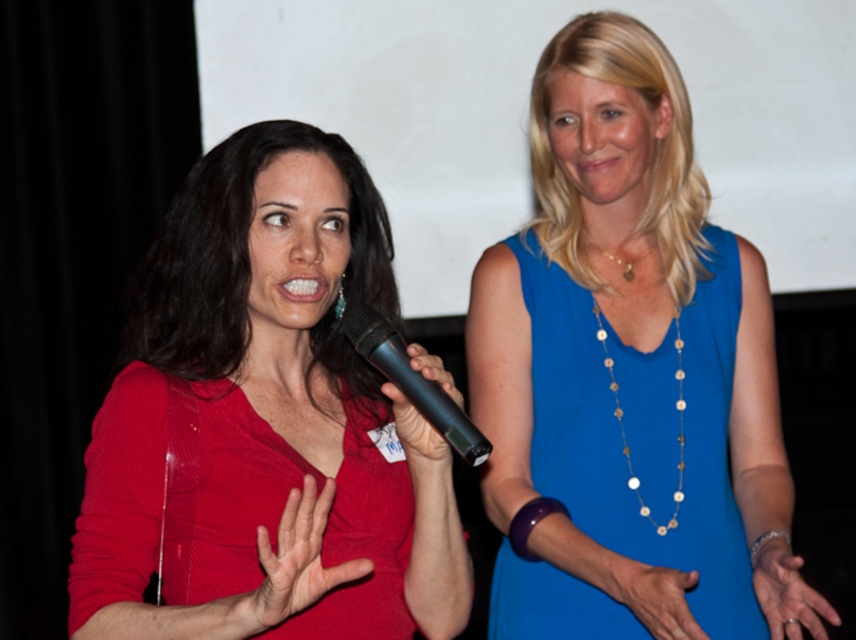
Question: Observing the image, what is the correct spatial positioning of matte red dress at center in reference to smooth skin hand at center?

Choices:
 (A) above
 (B) below

Answer: (A)

Question: Does blue silk dress at upper right appear on the left side of blue smooth hand at center?

Choices:
 (A) yes
 (B) no

Answer: (B)

Question: Among these points, which one is nearest to the camera?

Choices:
 (A) (379, 349)
 (B) (458, 416)

Answer: (B)

Question: Is matte red hand at center thinner than black plastic microphone at center?

Choices:
 (A) no
 (B) yes

Answer: (A)

Question: Which of the following is the farthest from the observer?

Choices:
 (A) (367, 355)
 (B) (366, 572)
 (C) (670, 572)
 (D) (199, 404)

Answer: (C)

Question: Which object is farther from the camera taking this photo?

Choices:
 (A) blue silk dress at upper right
 (B) matte red sweater at center
 (C) matte red hand at center
 (D) matte red dress at center

Answer: (A)